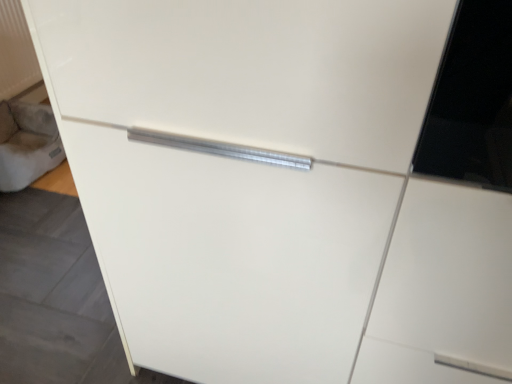
Find the location of a particular element. The height and width of the screenshot is (384, 512). suede-like gray cushion at lower left is located at coordinates (27, 144).

Describe the element at coordinates (27, 144) in the screenshot. Image resolution: width=512 pixels, height=384 pixels. I see `suede-like gray cushion at lower left` at that location.

What is the approximate width of white textured radiator at upper left?

white textured radiator at upper left is 2.44 inches in width.

Describe the element at coordinates (16, 51) in the screenshot. I see `white textured radiator at upper left` at that location.

The height and width of the screenshot is (384, 512). I want to click on white textured radiator at upper left, so click(x=16, y=51).

Where is `suede-like gray cushion at lower left`? The image size is (512, 384). suede-like gray cushion at lower left is located at coordinates (27, 144).

Is white textured radiator at upper left to the right of suede-like gray cushion at lower left from the viewer's perspective?

No.

Considering the relative positions of white textured radiator at upper left and suede-like gray cushion at lower left in the image provided, is white textured radiator at upper left behind suede-like gray cushion at lower left?

Yes.

Does point (13, 83) lie behind point (34, 164)?

That is True.

In the scene shown: From the image's perspective, would you say white textured radiator at upper left is positioned over suede-like gray cushion at lower left?

Yes, from the image's perspective, white textured radiator at upper left is above suede-like gray cushion at lower left.

From a real-world perspective, does white textured radiator at upper left sit lower than suede-like gray cushion at lower left?

No, from a real-world perspective, white textured radiator at upper left is not beneath suede-like gray cushion at lower left.

Can you confirm if white textured radiator at upper left is wider than suede-like gray cushion at lower left?

No, white textured radiator at upper left is not wider than suede-like gray cushion at lower left.

Between white textured radiator at upper left and suede-like gray cushion at lower left, which one has less height?

With less height is suede-like gray cushion at lower left.

Considering the sizes of objects white textured radiator at upper left and suede-like gray cushion at lower left in the image provided, who is bigger, white textured radiator at upper left or suede-like gray cushion at lower left?

With larger size is suede-like gray cushion at lower left.

From the picture: Which is correct: white textured radiator at upper left is inside suede-like gray cushion at lower left, or outside of it?

white textured radiator at upper left exists outside the volume of suede-like gray cushion at lower left.

Is the surface of white textured radiator at upper left in direct contact with suede-like gray cushion at lower left?

white textured radiator at upper left and suede-like gray cushion at lower left are not in contact.

In the scene shown: Is white textured radiator at upper left facing away from suede-like gray cushion at lower left?

No, white textured radiator at upper left's orientation is not away from suede-like gray cushion at lower left.

Measure the distance from white textured radiator at upper left to suede-like gray cushion at lower left.

white textured radiator at upper left and suede-like gray cushion at lower left are 13.87 inches apart.

Identify the location of gray that appears below the white textured radiator at upper left (from a real-world perspective). The width and height of the screenshot is (512, 384). pos(27,144).

Considering the positions of objects suede-like gray cushion at lower left and white textured radiator at upper left in the image provided, who is more to the right, suede-like gray cushion at lower left or white textured radiator at upper left?

suede-like gray cushion at lower left is more to the right.

Is suede-like gray cushion at lower left further to camera compared to white textured radiator at upper left?

No, suede-like gray cushion at lower left is closer to the viewer.

Is point (39, 152) farther from camera compared to point (30, 68)?

No, (39, 152) is in front of (30, 68).

From the image's perspective, is suede-like gray cushion at lower left under white textured radiator at upper left?

Yes, from the image's perspective, suede-like gray cushion at lower left is beneath white textured radiator at upper left.

From a real-world perspective, which object stands above the other?

white textured radiator at upper left is physically above.

Does suede-like gray cushion at lower left have a greater width compared to white textured radiator at upper left?

Yes, suede-like gray cushion at lower left is wider than white textured radiator at upper left.

In the scene shown: From their relative heights in the image, would you say suede-like gray cushion at lower left is taller or shorter than white textured radiator at upper left?

Clearly, suede-like gray cushion at lower left is shorter compared to white textured radiator at upper left.

Between suede-like gray cushion at lower left and white textured radiator at upper left, which one has smaller size?

Smaller between the two is white textured radiator at upper left.

Choose the correct answer: Is suede-like gray cushion at lower left inside white textured radiator at upper left or outside it?

suede-like gray cushion at lower left exists outside the volume of white textured radiator at upper left.

Is suede-like gray cushion at lower left far from white textured radiator at upper left?

No, suede-like gray cushion at lower left is not far from white textured radiator at upper left.

Does suede-like gray cushion at lower left turn towards white textured radiator at upper left?

No, suede-like gray cushion at lower left is not turned towards white textured radiator at upper left.

How different are the orientations of suede-like gray cushion at lower left and white textured radiator at upper left in degrees?

1.59 degrees.

Image resolution: width=512 pixels, height=384 pixels. Find the location of `gray in front of the white textured radiator at upper left`. gray in front of the white textured radiator at upper left is located at coordinates (27, 144).

This screenshot has width=512, height=384. What are the coordinates of `gray that is below the white textured radiator at upper left (from the image's perspective)` in the screenshot? It's located at (27, 144).

Identify the location of gray that is in front of the white textured radiator at upper left. The width and height of the screenshot is (512, 384). (27, 144).